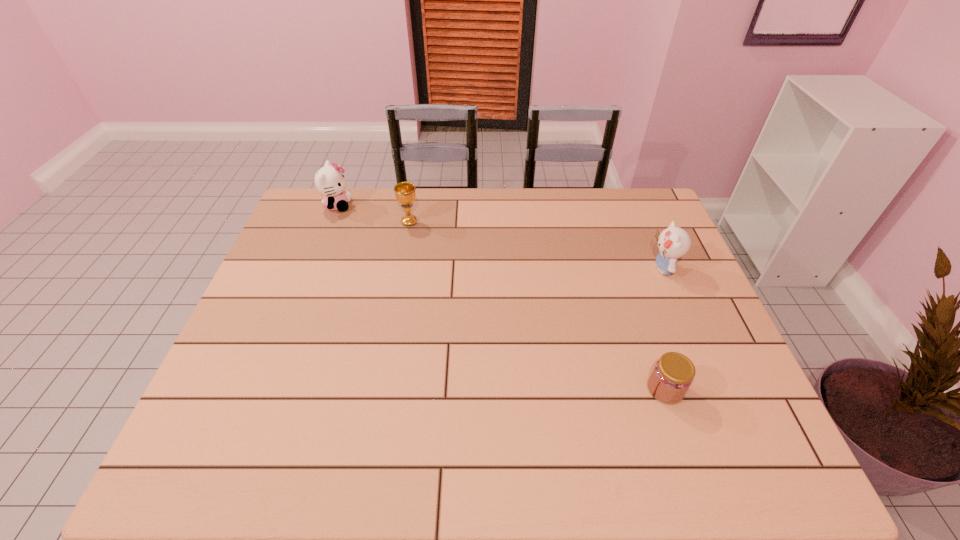
This screenshot has height=540, width=960. Identify the location of unoccupied position between the chalice and the right kitten. (536, 245).

The width and height of the screenshot is (960, 540). I want to click on free point between the third farthest object and the shortest object, so click(x=664, y=329).

The image size is (960, 540). Find the location of `vacant space that's between the farther kitten and the shortest object`. vacant space that's between the farther kitten and the shortest object is located at coordinates (501, 297).

At what (x,y) coordinates should I click in order to perform the action: click on unoccupied area between the third object from left to right and the nearer kitten. Please return your answer as a coordinate pair (x, y). This screenshot has height=540, width=960. Looking at the image, I should click on (664, 329).

What are the coordinates of `object that is the second closest one to the third object from left to right` in the screenshot? It's located at (405, 194).

I want to click on the closest object to the third object from left to right, so click(x=674, y=242).

This screenshot has width=960, height=540. In order to click on free space that satisfies the following two spatial constraints: 1. on the front-facing side of the left kitten; 2. on the right side of the second object from left to right in this screenshot , I will do `click(331, 222)`.

At what (x,y) coordinates should I click in order to perform the action: click on vacant space that satisfies the following two spatial constraints: 1. on the front-facing side of the third object from right to left; 2. on the left side of the farther kitten. Please return your answer as a coordinate pair (x, y). Looking at the image, I should click on (331, 222).

Locate an element on the screen. Image resolution: width=960 pixels, height=540 pixels. vacant area in the image that satisfies the following two spatial constraints: 1. on the front-facing side of the second object from right to left; 2. on the left side of the leftmost object is located at coordinates (267, 389).

This screenshot has width=960, height=540. Find the location of `vacant point that satisfies the following two spatial constraints: 1. on the front-facing side of the leftmost object; 2. on the back side of the chalice`. vacant point that satisfies the following two spatial constraints: 1. on the front-facing side of the leftmost object; 2. on the back side of the chalice is located at coordinates (331, 222).